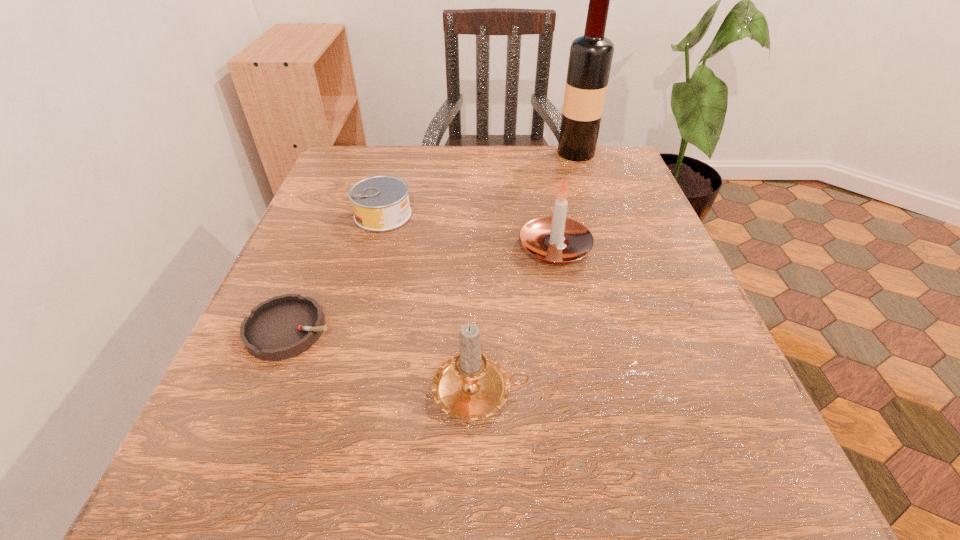
What are the coordinates of `wine bottle` in the screenshot? It's located at (590, 59).

Locate an element on the screen. The width and height of the screenshot is (960, 540). the tallest object is located at coordinates (590, 59).

This screenshot has width=960, height=540. I want to click on the farther candle, so click(555, 239).

What are the coordinates of `the nearer candle` in the screenshot? It's located at (470, 386).

In order to click on the third object from right to left in this screenshot , I will do `click(470, 386)`.

The image size is (960, 540). I want to click on can, so click(x=380, y=203).

You are a GUI agent. You are given a task and a screenshot of the screen. Output one action in this format:
    pyautogui.click(x=<x>, y=<y>)
    Task: Click on the ashtray
    
    Given the screenshot: What is the action you would take?
    pyautogui.click(x=282, y=327)

Locate an element on the screen. This screenshot has height=540, width=960. blank space located 0.090m on the front of the tallest object is located at coordinates (586, 181).

Where is `free space located on the back of the farther candle`? The image size is (960, 540). free space located on the back of the farther candle is located at coordinates (540, 176).

The height and width of the screenshot is (540, 960). What are the coordinates of `free space located on the right of the third object from right to left` in the screenshot? It's located at (600, 392).